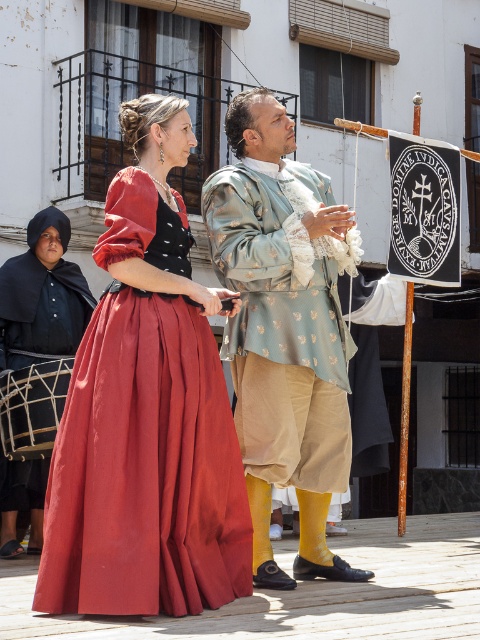
Who is lower down, silk dress at center or satin dress at center?

satin dress at center is lower down.

What do you see at coordinates (193, 385) in the screenshot?
I see `silk dress at center` at bounding box center [193, 385].

Describe the element at coordinates (193, 385) in the screenshot. The image size is (480, 640). I see `silk dress at center` at that location.

You are a GUI agent. You are given a task and a screenshot of the screen. Output one action in this format:
    pyautogui.click(x=<x>, y=<y>)
    Task: Click on the silk dress at center
    
    Given the screenshot: What is the action you would take?
    tap(193, 385)

Does satin dress at center appear over silky blue fabric at center?

No.

Is satin dress at center to the left of silky blue fabric at center from the viewer's perspective?

Yes, satin dress at center is to the left of silky blue fabric at center.

Locate an element on the screen. satin dress at center is located at coordinates (144, 470).

Does satin dress at center have a lesser width compared to satin black dress at left?

No, satin dress at center is not thinner than satin black dress at left.

Who is higher up, satin dress at center or satin black dress at left?

Positioned higher is satin black dress at left.

Does point (99, 384) lie in front of point (50, 228)?

Yes, it is.

At what (x,y) coordinates should I click in order to perform the action: click on satin dress at center. Please return your answer as a coordinate pair (x, y). Image resolution: width=480 pixels, height=640 pixels. Looking at the image, I should click on (144, 470).